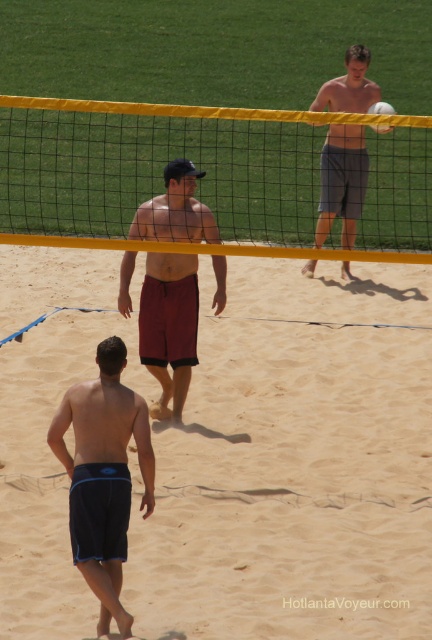
You are a player in the beach volleyball game. You need to move from your current position to the point marked as point (206,355). Is this point closer to the net or further away from the net compared to point (339,83)?

Point (206,355) is in front of point (339,83), so it is closer to the net than point (339,83).